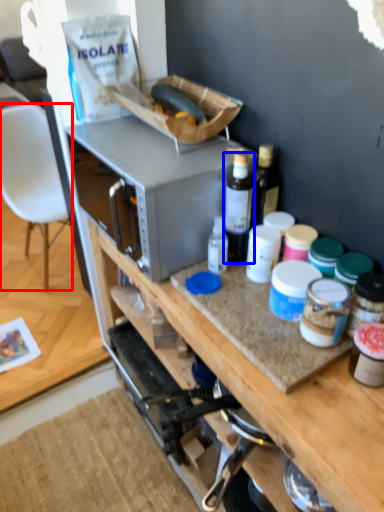
Question: Which object is further to the camera taking this photo, chair (highlighted by a red box) or bottle (highlighted by a blue box)?

Choices:
 (A) chair
 (B) bottle

Answer: (A)